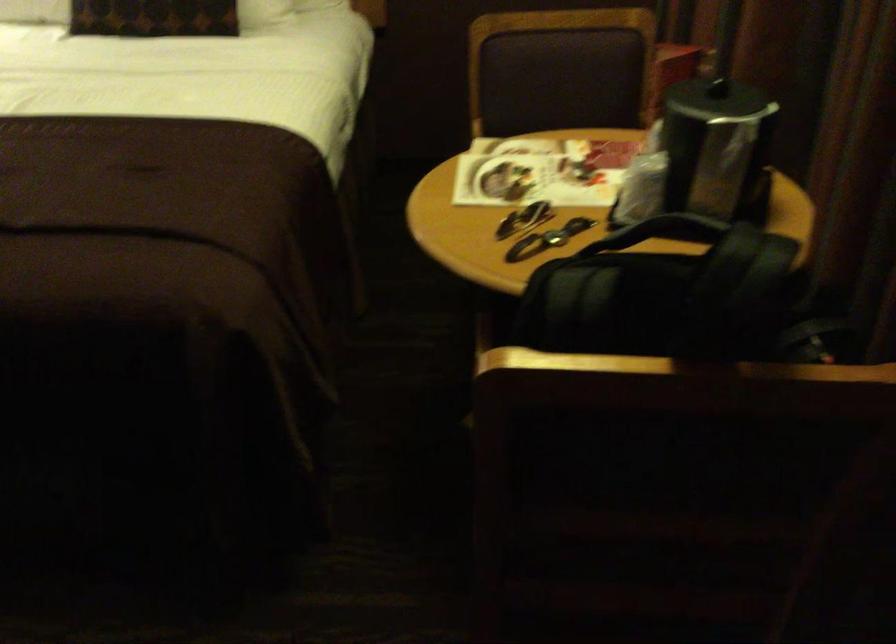
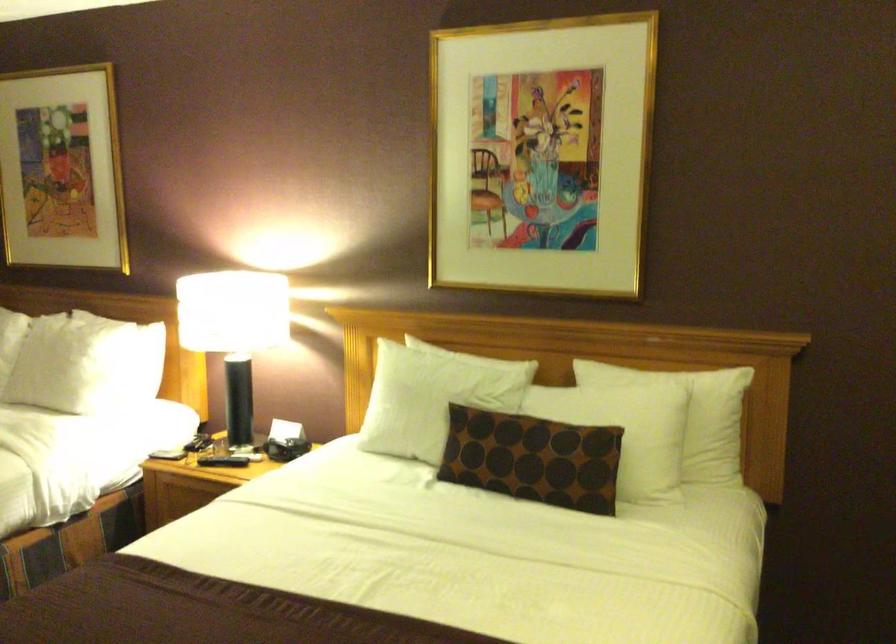
How did the camera likely rotate?

The camera rotated toward left-up.